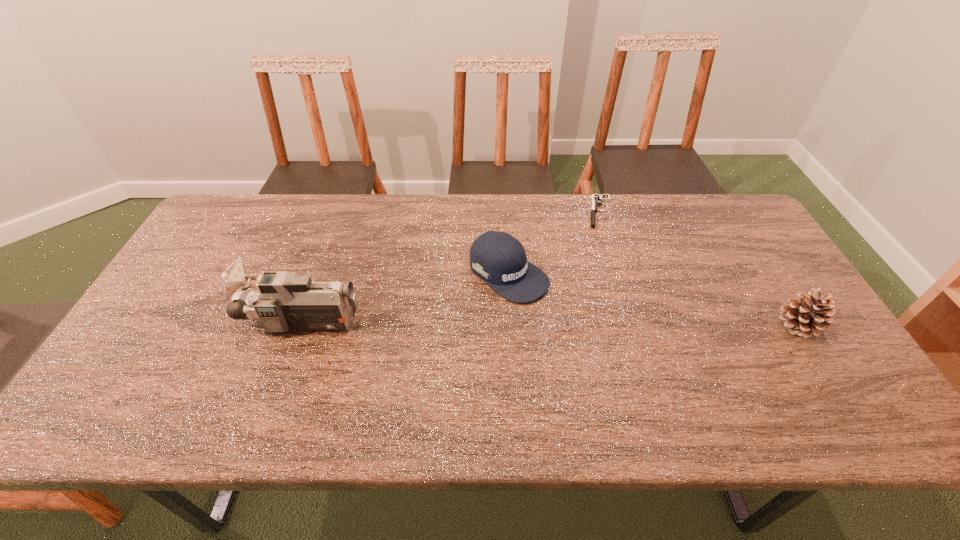
Find the location of a particular element. This screenshot has width=960, height=540. free space at the left edge is located at coordinates click(219, 271).

The height and width of the screenshot is (540, 960). In the image, there is a desktop. Identify the location of vacant space at the near left corner. (141, 390).

Identify the location of vacant region at the far right corner. (728, 197).

In the image, there is a desktop. In order to click on vacant space at the near right corner in this screenshot , I will do (x=822, y=363).

Locate an element on the screen. The width and height of the screenshot is (960, 540). vacant region between the rightmost object and the second object from right to left is located at coordinates (699, 268).

Image resolution: width=960 pixels, height=540 pixels. Identify the location of empty space between the camcorder and the second object from right to left. [451, 267].

Where is `empty space that is in between the second object from right to left and the baseball cap`? empty space that is in between the second object from right to left and the baseball cap is located at coordinates (x=554, y=243).

Image resolution: width=960 pixels, height=540 pixels. Find the location of `vacant point located between the baseball cap and the camcorder`. vacant point located between the baseball cap and the camcorder is located at coordinates (406, 298).

Identify the location of free space between the third tallest object and the third object from left to right. This screenshot has width=960, height=540. (554, 243).

At what (x,y) coordinates should I click in order to perform the action: click on free area in between the rightmost object and the tallest object. Please return your answer as a coordinate pair (x, y). This screenshot has height=540, width=960. Looking at the image, I should click on (551, 323).